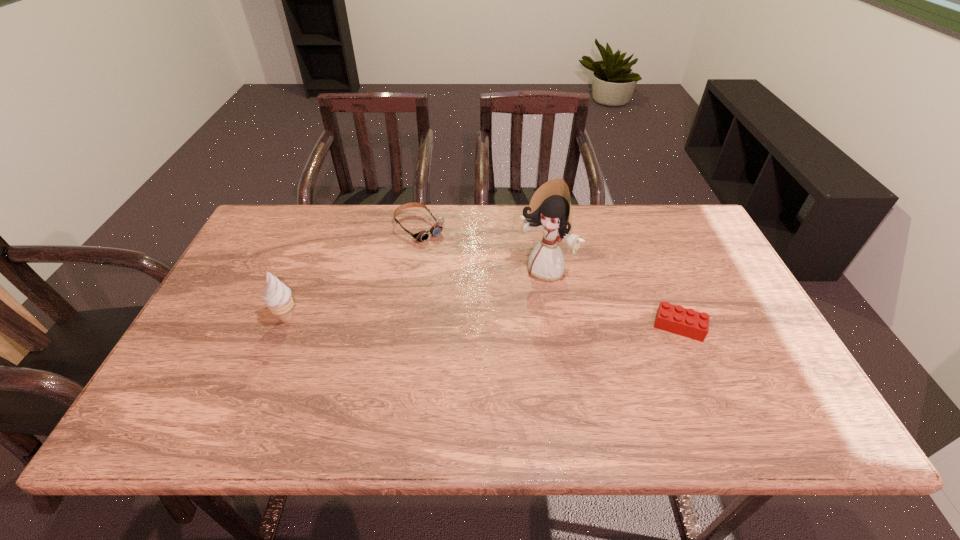
I want to click on vacant area at the near edge, so click(x=633, y=370).

In the image, there is a desktop. What are the coordinates of `free space at the left edge` in the screenshot? It's located at (268, 272).

The height and width of the screenshot is (540, 960). I want to click on free location at the right edge, so click(777, 350).

This screenshot has height=540, width=960. In the image, there is a desktop. What are the coordinates of `vacant area at the far left corner` in the screenshot? It's located at (257, 230).

I want to click on free space between the leftmost object and the goggles, so click(x=353, y=273).

This screenshot has width=960, height=540. What are the coordinates of `free space between the doll and the third shortest object` in the screenshot? It's located at (417, 295).

The height and width of the screenshot is (540, 960). In order to click on empty space between the third object from left to right and the Lego in this screenshot , I will do `click(612, 299)`.

This screenshot has height=540, width=960. In order to click on free area in between the icecream and the second farthest object in this screenshot , I will do `click(417, 295)`.

Where is `free space between the Lego and the second tallest object`? The image size is (960, 540). free space between the Lego and the second tallest object is located at coordinates (483, 322).

Locate an element on the screen. The width and height of the screenshot is (960, 540). unoccupied position between the Lego and the tallest object is located at coordinates (612, 299).